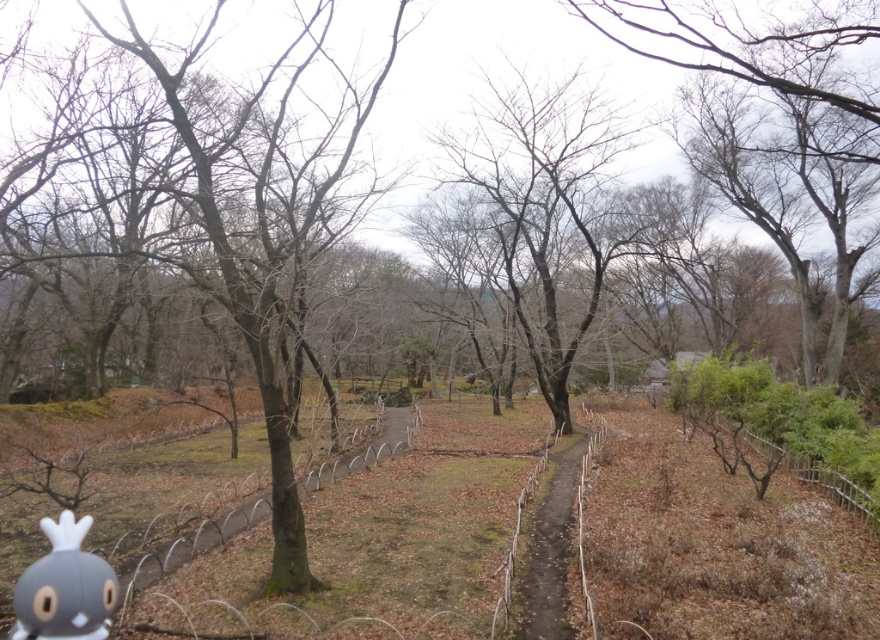
Does bare branches at upper right have a lesser height compared to matte gray plush toy at lower left?

No.

Between bare branches at upper right and matte gray plush toy at lower left, which one appears on the left side from the viewer's perspective?

matte gray plush toy at lower left

I want to click on bare branches at upper right, so click(779, 115).

Can you confirm if brown rough bark tree at center is positioned below brown dirt path at center?

No.

Does point (244, 300) come closer to viewer compared to point (548, 566)?

That is True.

Image resolution: width=880 pixels, height=640 pixels. What are the coordinates of `brown rough bark tree at center` in the screenshot? It's located at (264, 216).

Does bare branches at upper right have a lesser width compared to brown dirt path at center?

Incorrect, bare branches at upper right's width is not less than brown dirt path at center's.

From the picture: Measure the distance between point (715, 38) and camera.

Point (715, 38) and camera are 12.84 meters apart.

At what (x,y) coordinates should I click in order to perform the action: click on bare branches at upper right. Please return your answer as a coordinate pair (x, y). This screenshot has height=640, width=880. Looking at the image, I should click on (779, 115).